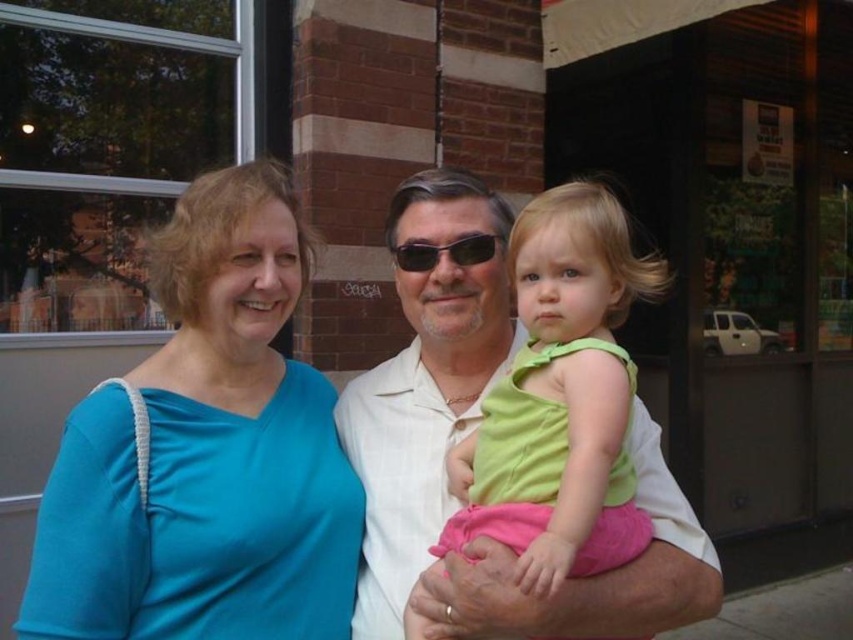
You are a tailor measuring shirts for alterations. You have two shirts in front of you, the blue fabric shirt at upper left and the white smooth shirt at center. Which shirt has a narrower width? Please answer based on the measurements provided.

The blue fabric shirt at upper left has a narrower width than the white smooth shirt at center.

You are standing in front of a brick building in a commercial area. You see a point at coordinate (x=134, y=573). If you want to place a 1.5 meter long banner from this point towards the camera, will it reach the camera?

The distance of point (x=134, y=573) from camera is 1.21 meters. Since the banner is 1.5 meters long, it will extend beyond the camera by 0.29 meters.